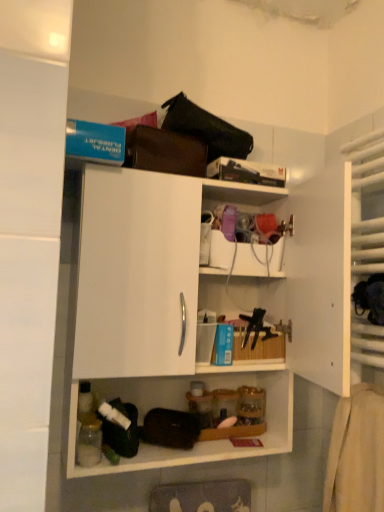
Question: Considering the relative sizes of white matte cabinet at center, which is counted as the 1th shelf, starting from the left, and translucent plastic container at upper center, positioned as the second shelf in left-to-right order, in the image provided, is white matte cabinet at center, which is counted as the 1th shelf, starting from the left, taller than translucent plastic container at upper center, positioned as the second shelf in left-to-right order,?

Choices:
 (A) no
 (B) yes

Answer: (B)

Question: Can you confirm if white matte cabinet at center, which is counted as the 2th shelf, starting from the right, is smaller than translucent plastic container at upper center, positioned as the second shelf in left-to-right order?

Choices:
 (A) yes
 (B) no

Answer: (B)

Question: Could you tell me if white matte cabinet at center, which is counted as the 2th shelf, starting from the right, is turned towards translucent plastic container at upper center, which is counted as the first shelf, starting from the right?

Choices:
 (A) yes
 (B) no

Answer: (B)

Question: From a real-world perspective, is white matte cabinet at center, which is counted as the 2th shelf, starting from the right, on top of translucent plastic container at upper center, which is counted as the first shelf, starting from the right?

Choices:
 (A) yes
 (B) no

Answer: (B)

Question: From the image's perspective, is white matte cabinet at center, which is counted as the 2th shelf, starting from the right, on top of translucent plastic container at upper center, positioned as the second shelf in left-to-right order?

Choices:
 (A) no
 (B) yes

Answer: (A)

Question: Can you confirm if white matte cabinet at center, which is counted as the 2th shelf, starting from the right, is positioned to the left of translucent plastic container at upper center, which is counted as the first shelf, starting from the right?

Choices:
 (A) yes
 (B) no

Answer: (A)

Question: Can you confirm if translucent plastic container at upper center, positioned as the second shelf in left-to-right order, is shorter than white matte cabinet at center, which is counted as the 1th shelf, starting from the left?

Choices:
 (A) no
 (B) yes

Answer: (B)

Question: Does translucent plastic container at upper center, which is counted as the first shelf, starting from the right, have a larger size compared to white matte cabinet at center, which is counted as the 1th shelf, starting from the left?

Choices:
 (A) no
 (B) yes

Answer: (A)

Question: Is translucent plastic container at upper center, which is counted as the first shelf, starting from the right, looking in the opposite direction of white matte cabinet at center, which is counted as the 2th shelf, starting from the right?

Choices:
 (A) no
 (B) yes

Answer: (B)

Question: From the image's perspective, is translucent plastic container at upper center, which is counted as the first shelf, starting from the right, located beneath white matte cabinet at center, which is counted as the 1th shelf, starting from the left?

Choices:
 (A) no
 (B) yes

Answer: (A)

Question: From a real-world perspective, is translucent plastic container at upper center, positioned as the second shelf in left-to-right order, located beneath white matte cabinet at center, which is counted as the 1th shelf, starting from the left?

Choices:
 (A) no
 (B) yes

Answer: (A)

Question: Can you confirm if translucent plastic container at upper center, positioned as the second shelf in left-to-right order, is thinner than white matte cabinet at center, which is counted as the 2th shelf, starting from the right?

Choices:
 (A) no
 (B) yes

Answer: (B)

Question: Does point (208, 181) appear closer or farther from the camera than point (157, 216)?

Choices:
 (A) closer
 (B) farther

Answer: (B)